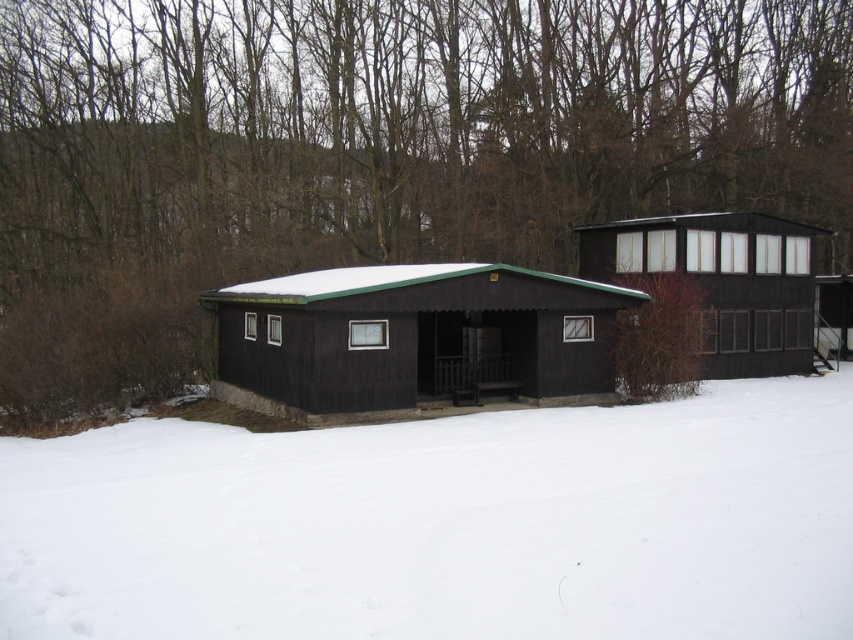
Is brown wood tree at upper center thinner than matte black cabin at upper right?

Incorrect, brown wood tree at upper center's width is not less than matte black cabin at upper right's.

Which is below, brown wood tree at upper center or matte black cabin at upper right?

matte black cabin at upper right is below.

Locate an element on the screen. The height and width of the screenshot is (640, 853). brown wood tree at upper center is located at coordinates (373, 148).

Does brown wood tree at upper center have a greater width compared to matte black cabin at center?

Yes, brown wood tree at upper center is wider than matte black cabin at center.

Does point (782, 179) lie behind point (311, 356)?

That is True.

Does point (59, 280) come farther from viewer compared to point (221, 308)?

Yes.

Find the location of a particular element. Image resolution: width=853 pixels, height=640 pixels. brown wood tree at upper center is located at coordinates (373, 148).

Who is shorter, white powdery snow at lower center or matte black cabin at center?

white powdery snow at lower center is shorter.

Is white powdery snow at lower center thinner than matte black cabin at center?

No.

Measure the distance between white powdery snow at lower center and camera.

The distance of white powdery snow at lower center from camera is 4.94 meters.

You are a GUI agent. You are given a task and a screenshot of the screen. Output one action in this format:
    pyautogui.click(x=<x>, y=<y>)
    Task: Click on the white powdery snow at lower center
    The height and width of the screenshot is (640, 853).
    Given the screenshot: What is the action you would take?
    pyautogui.click(x=445, y=524)